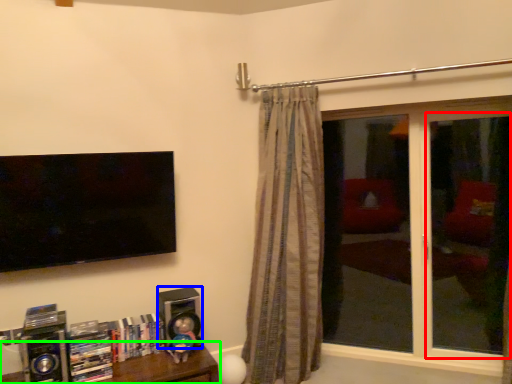
Question: Estimate the real-world distances between objects in this image. Which object is closer to screen door (highlighted by a red box), speaker (highlighted by a blue box) or furniture (highlighted by a green box)?

Choices:
 (A) speaker
 (B) furniture

Answer: (A)